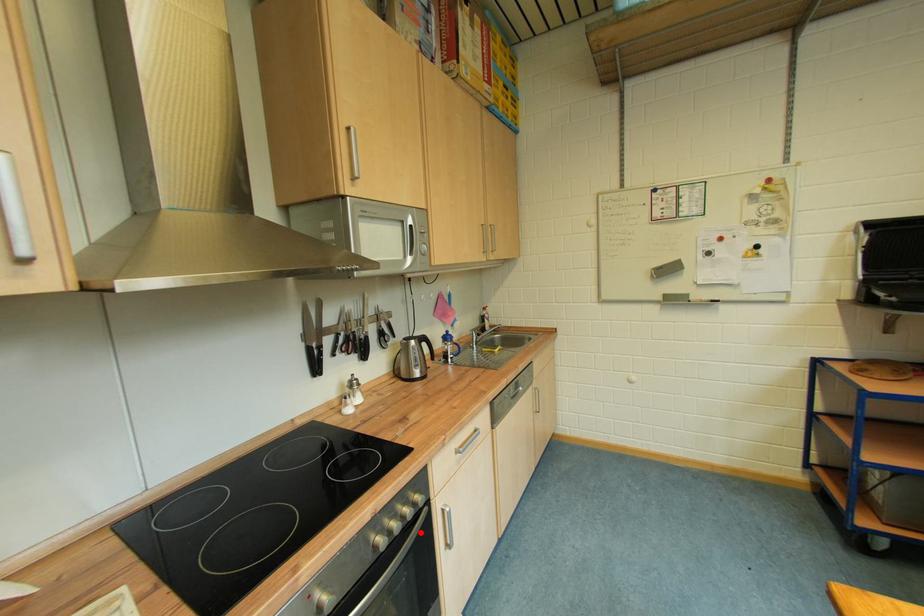
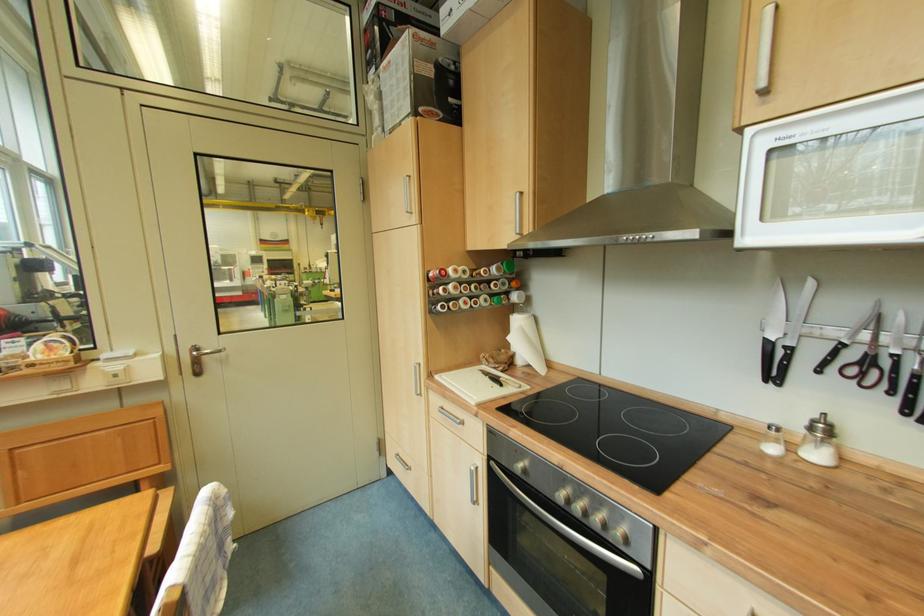
Find the pixel in the second image that matches the highlighted location in the first image.

(614, 556)